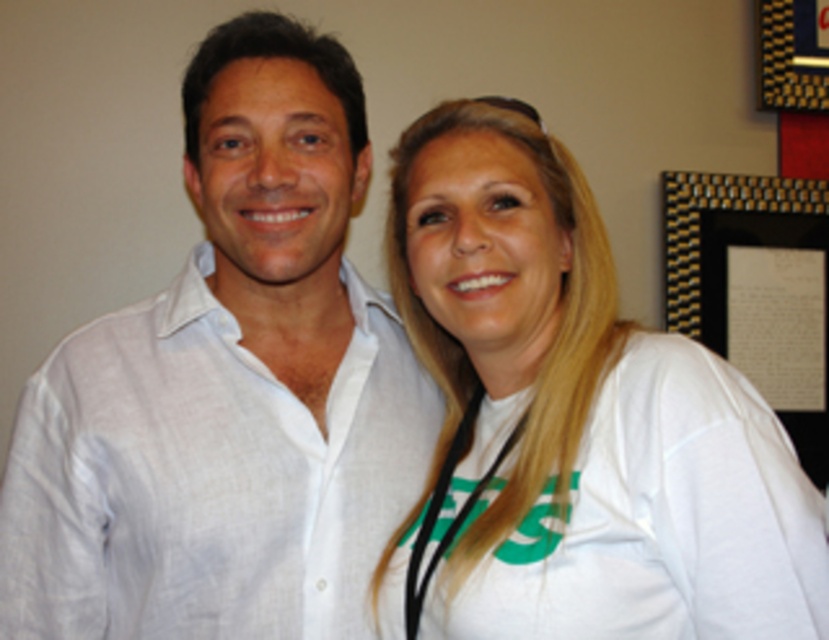
Question: Does black glossy picture frame at upper right appear on the right side of gold textured frame at upper right?

Choices:
 (A) no
 (B) yes

Answer: (A)

Question: Does white cotton t-shirt at center appear over white linen shirt at center?

Choices:
 (A) no
 (B) yes

Answer: (B)

Question: Estimate the real-world distances between objects in this image. Which object is farther from the white cotton t-shirt at center?

Choices:
 (A) white linen shirt at center
 (B) gold textured frame at upper right

Answer: (B)

Question: Which of the following is the farthest from the observer?

Choices:
 (A) click(42, 509)
 (B) click(754, 362)
 (C) click(398, 595)

Answer: (B)

Question: Which point is closer to the camera?

Choices:
 (A) (282, 634)
 (B) (626, 358)
 (C) (760, 12)

Answer: (B)

Question: From the image, what is the correct spatial relationship of white cotton t-shirt at center in relation to gold textured frame at upper right?

Choices:
 (A) left
 (B) right

Answer: (A)